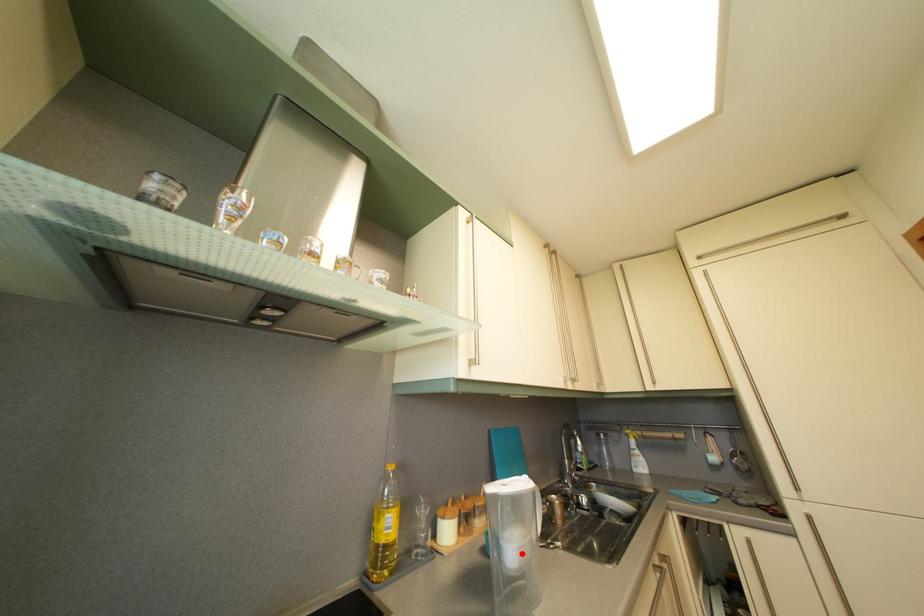
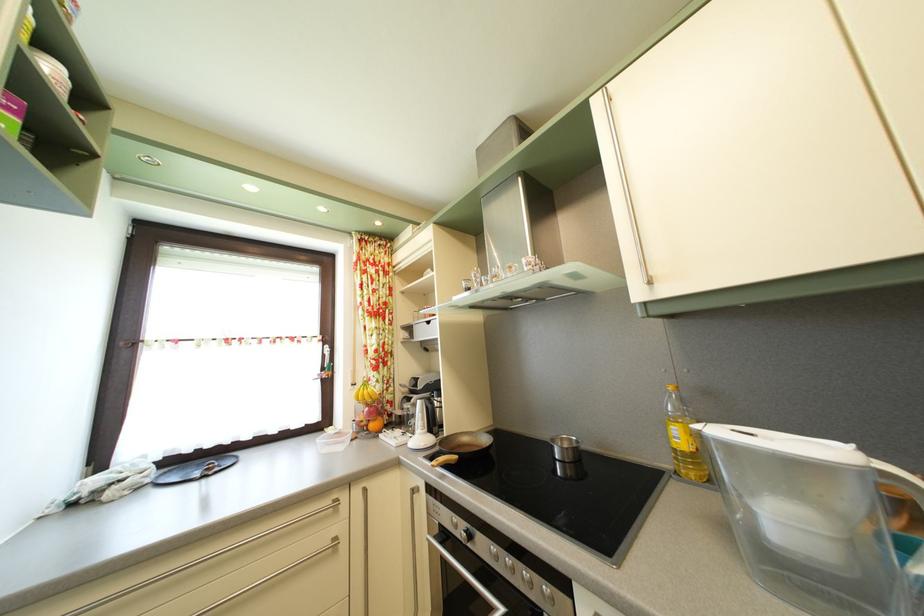
The point at the highlighted location is marked in the first image. Where is the corresponding point in the second image?

(793, 528)